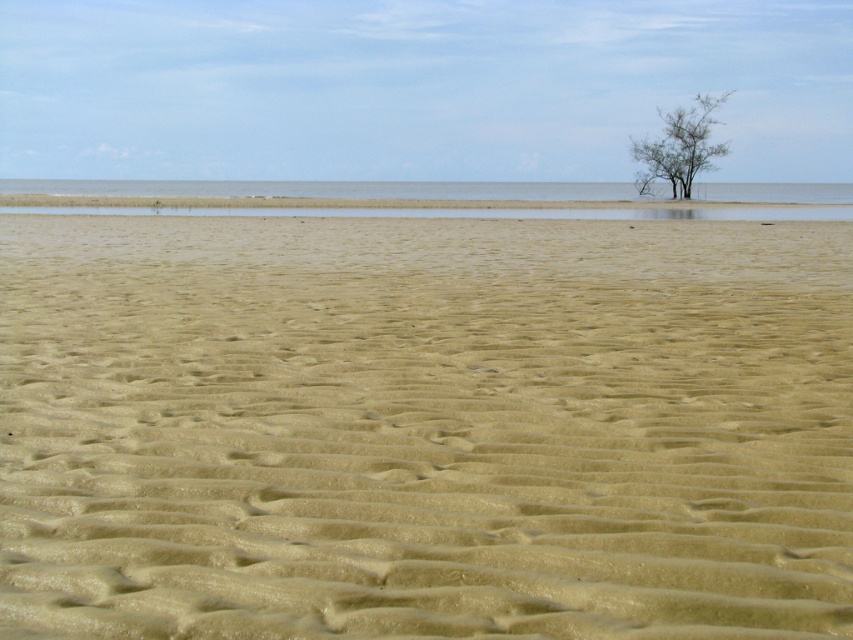
Question: Considering the real-world distances, which object is closest to the smooth sand at center?

Choices:
 (A) green leafy tree at upper right
 (B) clear water at center

Answer: (B)

Question: Does smooth sand at center appear under green leafy tree at upper right?

Choices:
 (A) yes
 (B) no

Answer: (A)

Question: Which point is closer to the camera taking this photo?

Choices:
 (A) (653, 147)
 (B) (573, 198)

Answer: (B)

Question: Is clear water at center above green leafy tree at upper right?

Choices:
 (A) no
 (B) yes

Answer: (A)

Question: Which point is closer to the camera taking this photo?

Choices:
 (A) (648, 154)
 (B) (578, 212)
 (C) (379, 332)

Answer: (C)

Question: Is clear water at center above green leafy tree at upper right?

Choices:
 (A) no
 (B) yes

Answer: (A)